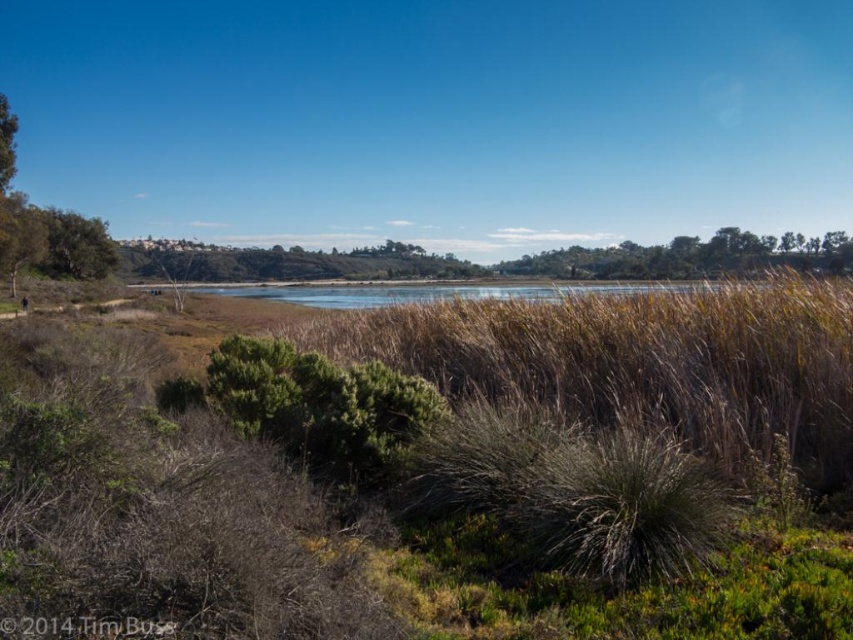
Between brown grass at center and green leafy tree at left, which one is positioned higher?

Positioned higher is green leafy tree at left.

Can you confirm if brown grass at center is positioned to the left of green leafy tree at left?

No, brown grass at center is not to the left of green leafy tree at left.

Which is behind, point (601, 392) or point (50, 260)?

The point (50, 260) is more distant.

The width and height of the screenshot is (853, 640). I want to click on brown grass at center, so click(643, 362).

Who is shorter, brown dry grass at center or brown grass at center?

brown grass at center is shorter.

In order to click on brown dry grass at center in this screenshot , I will do `click(399, 456)`.

This screenshot has width=853, height=640. What do you see at coordinates (399, 456) in the screenshot?
I see `brown dry grass at center` at bounding box center [399, 456].

Find the location of `brown dry grass at center`. brown dry grass at center is located at coordinates (399, 456).

How far apart are brown dry grass at center and green leafy tree at left?

69.32 meters

Is brown dry grass at center positioned in front of green leafy tree at left?

Yes, it is.

Describe the element at coordinates (399, 456) in the screenshot. This screenshot has width=853, height=640. I see `brown dry grass at center` at that location.

Find the location of `brown dry grass at center`. brown dry grass at center is located at coordinates (399, 456).